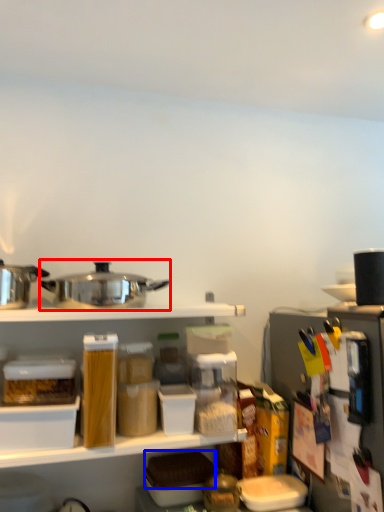
Question: Among these objects, which one is farthest to the camera, appliance (highlighted by a red box) or food (highlighted by a blue box)?

Choices:
 (A) appliance
 (B) food

Answer: (B)